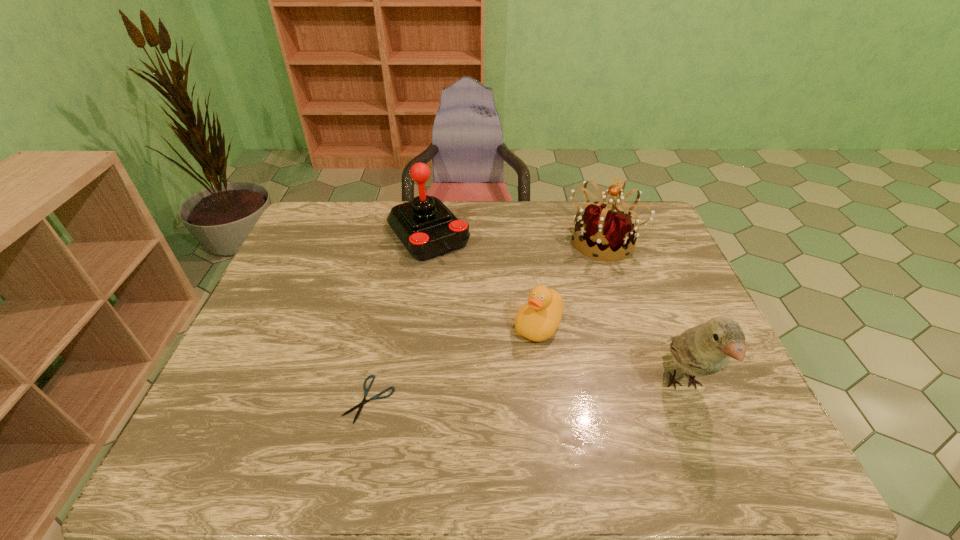
Where is `free space between the bird and the tiara`? This screenshot has height=540, width=960. free space between the bird and the tiara is located at coordinates (643, 313).

Find the location of `free space between the fourth tallest object and the joystick`. free space between the fourth tallest object and the joystick is located at coordinates (484, 279).

This screenshot has height=540, width=960. What are the coordinates of `vacant region between the tiara and the third object from right to left` in the screenshot? It's located at click(x=570, y=283).

At what (x,y) coordinates should I click in order to perform the action: click on free space between the third object from right to left and the tiara. Please return your answer as a coordinate pair (x, y). This screenshot has width=960, height=540. Looking at the image, I should click on (570, 283).

The height and width of the screenshot is (540, 960). I want to click on vacant area that lies between the shortest object and the tiara, so click(x=486, y=320).

In order to click on free space between the bird and the shortest object in this screenshot , I will do `click(526, 392)`.

This screenshot has width=960, height=540. Identify the location of vacant space that's between the bird and the third object from left to right. (612, 354).

Where is `unoccupied position between the tiara and the third farthest object`? The width and height of the screenshot is (960, 540). unoccupied position between the tiara and the third farthest object is located at coordinates (570, 283).

The image size is (960, 540). I want to click on object that is the third closest to the third nearest object, so click(427, 228).

Locate an element on the screen. object that is the third nearest to the tiara is located at coordinates (705, 349).